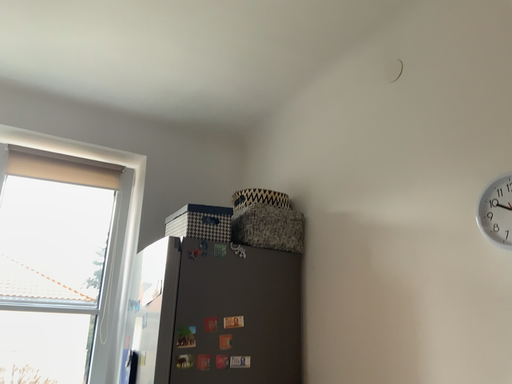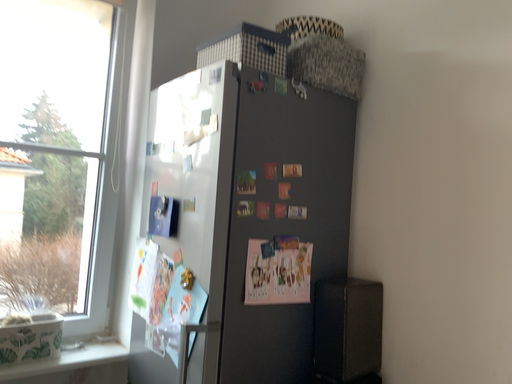
Question: How did the camera likely rotate when shooting the video?

Choices:
 (A) rotated right
 (B) rotated left

Answer: (A)